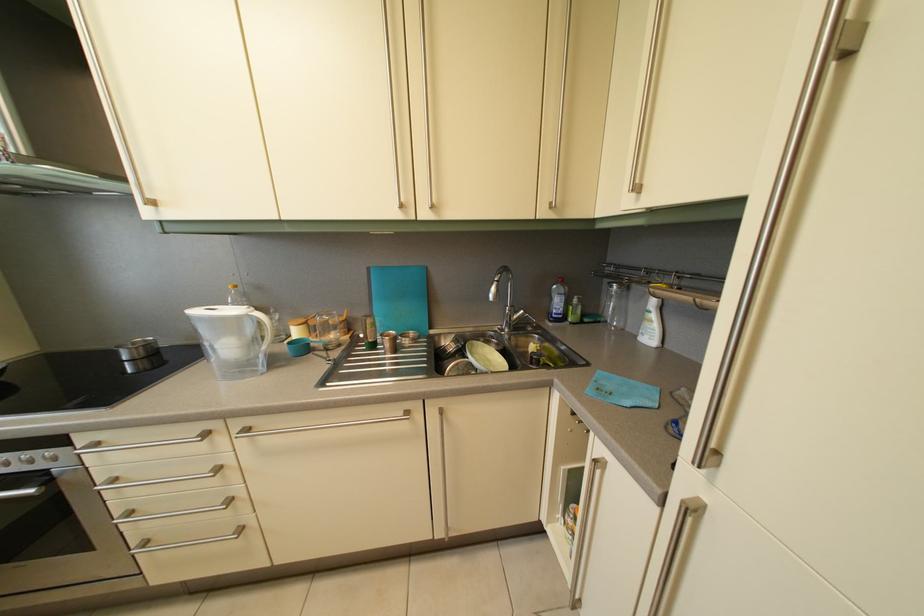
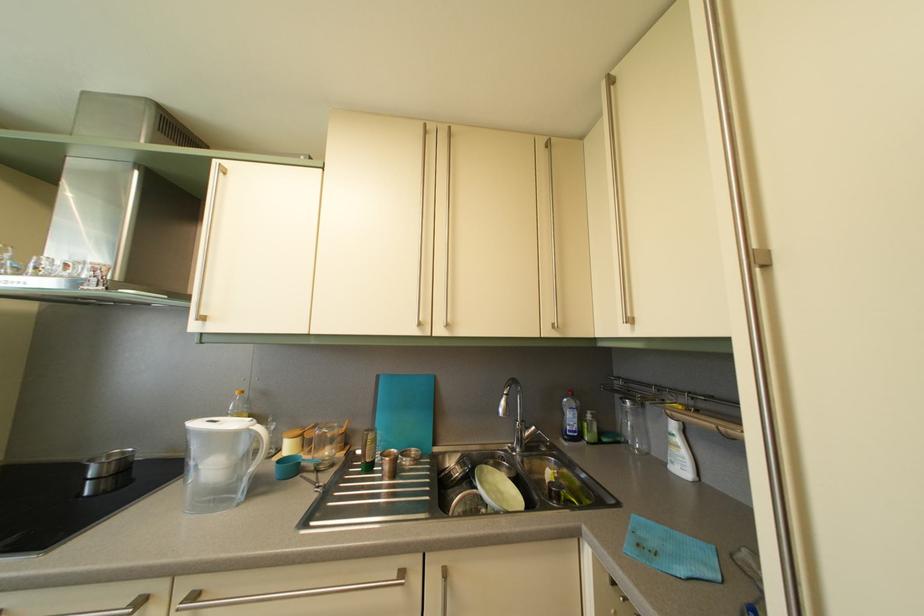
Find the pixel in the second image that matches the point at 286,325 in the first image.

(282, 435)